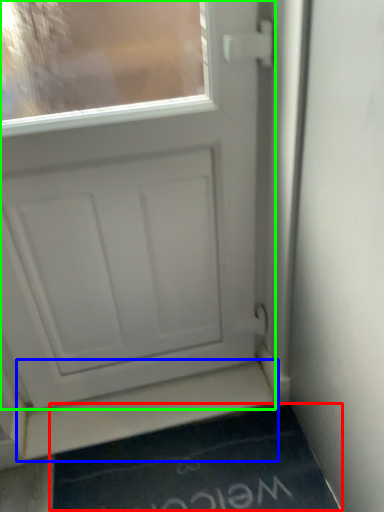
Question: Which is nearer to the doormat (highlighted by a red box)? stairwell (highlighted by a blue box) or door (highlighted by a green box).

Choices:
 (A) stairwell
 (B) door

Answer: (A)